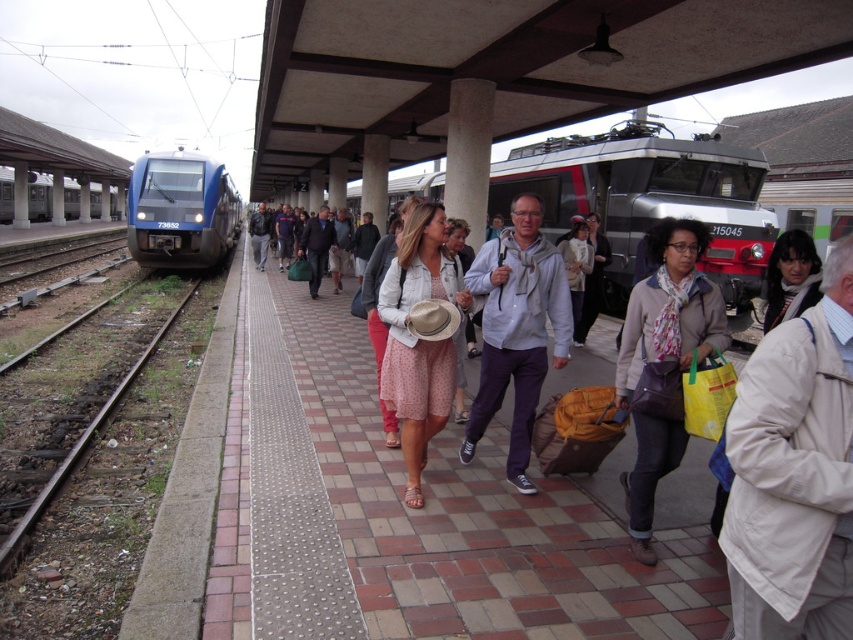
Who is higher up, brown gravel train track at left or white concrete pillar at center?

white concrete pillar at center is above.

At what (x,y) coordinates should I click in order to perform the action: click on brown gravel train track at left. Please return your answer as a coordinate pair (x, y). This screenshot has height=640, width=853. Looking at the image, I should click on 80,445.

Which of these two, matte beige scarf at center or light gray hoodie at center, stands taller?

light gray hoodie at center is taller.

Does matte beige scarf at center appear on the right side of light gray hoodie at center?

Correct, you'll find matte beige scarf at center to the right of light gray hoodie at center.

Identify the location of matte beige scarf at center. (663, 362).

Where is `matte beige scarf at center`? This screenshot has width=853, height=640. matte beige scarf at center is located at coordinates (663, 362).

Does matte beige scarf at center have a larger size compared to blue metallic train at left?

No, matte beige scarf at center is not bigger than blue metallic train at left.

Looking at this image, who is shorter, matte beige scarf at center or blue metallic train at left?

matte beige scarf at center

Does point (635, 513) come in front of point (114, 209)?

Yes, it is.

Locate an element on the screen. Image resolution: width=853 pixels, height=640 pixels. matte beige scarf at center is located at coordinates (663, 362).